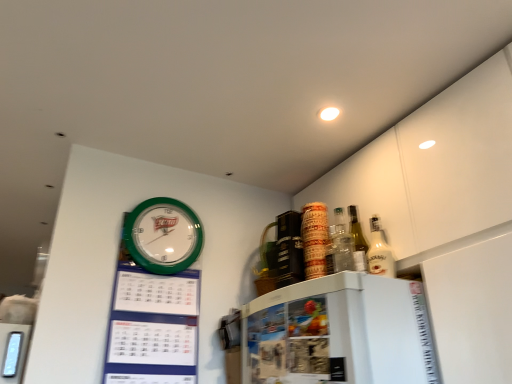
Question: Can you confirm if white glossy bottle at upper right is thinner than green plastic wall clock at upper left?

Choices:
 (A) yes
 (B) no

Answer: (B)

Question: Is white glossy bottle at upper right touching green plastic wall clock at upper left?

Choices:
 (A) no
 (B) yes

Answer: (A)

Question: Is the position of white glossy bottle at upper right less distant than that of green plastic wall clock at upper left?

Choices:
 (A) yes
 (B) no

Answer: (A)

Question: Is white glossy bottle at upper right facing towards green plastic wall clock at upper left?

Choices:
 (A) no
 (B) yes

Answer: (A)

Question: Is green plastic wall clock at upper left at the back of white glossy bottle at upper right?

Choices:
 (A) no
 (B) yes

Answer: (A)

Question: Does white glossy bottle at upper right have a greater width compared to green plastic wall clock at upper left?

Choices:
 (A) no
 (B) yes

Answer: (B)

Question: Is green plastic calendar at upper left facing towards green plastic wall clock at upper left?

Choices:
 (A) yes
 (B) no

Answer: (A)

Question: Is green plastic calendar at upper left taller than green plastic wall clock at upper left?

Choices:
 (A) no
 (B) yes

Answer: (B)

Question: Considering the relative sizes of green plastic calendar at upper left and green plastic wall clock at upper left in the image provided, is green plastic calendar at upper left bigger than green plastic wall clock at upper left?

Choices:
 (A) no
 (B) yes

Answer: (B)

Question: Considering the relative sizes of green plastic calendar at upper left and green plastic wall clock at upper left in the image provided, is green plastic calendar at upper left thinner than green plastic wall clock at upper left?

Choices:
 (A) no
 (B) yes

Answer: (A)

Question: From a real-world perspective, is green plastic calendar at upper left under green plastic wall clock at upper left?

Choices:
 (A) yes
 (B) no

Answer: (A)

Question: Is green plastic calendar at upper left shorter than green plastic wall clock at upper left?

Choices:
 (A) no
 (B) yes

Answer: (A)

Question: Is green plastic wall clock at upper left bigger than green plastic calendar at upper left?

Choices:
 (A) no
 (B) yes

Answer: (A)